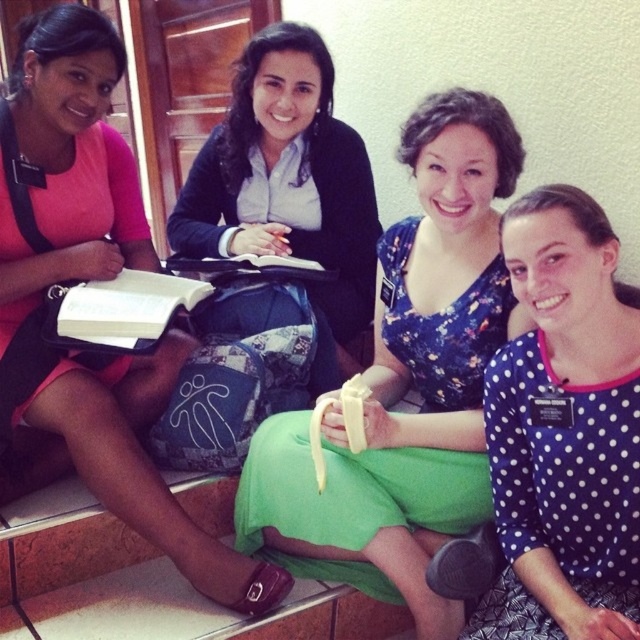
Question: Among these points, which one is farthest from the camera?

Choices:
 (A) (333, 422)
 (B) (74, 444)
 (C) (212, 141)
 (D) (552, 480)

Answer: (C)

Question: Which point appears closest to the camera in this image?

Choices:
 (A) pos(243,196)
 (B) pos(563,232)
 (C) pos(60,374)

Answer: (B)

Question: Is blue polka dot shirt at center positioned at the back of matte black sweater at center?

Choices:
 (A) yes
 (B) no

Answer: (B)

Question: Does pink matte shirt at upper left appear on the left side of matte black sweater at center?

Choices:
 (A) yes
 (B) no

Answer: (A)

Question: Does pink matte shirt at upper left appear over matte black sweater at center?

Choices:
 (A) yes
 (B) no

Answer: (B)

Question: Among these objects, which one is farthest from the camera?

Choices:
 (A) floral fabric dress at center
 (B) pink matte shirt at upper left
 (C) matte black sweater at center
 (D) blue polka dot shirt at center

Answer: (C)